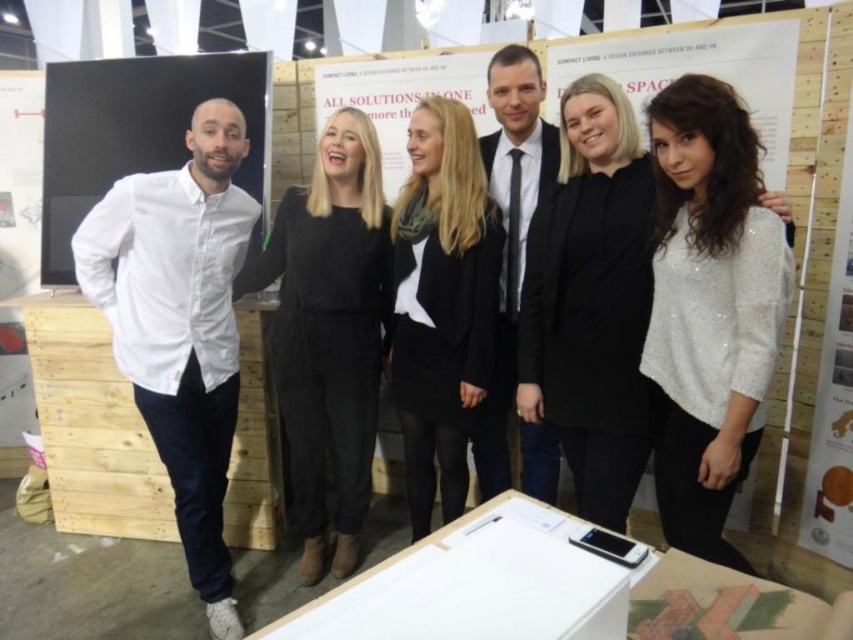
You are standing in front of the group at the exhibition booth. You need to locate the black matte blazer at center. Where exactly is it positioned in relation to the group?

The black matte blazer at center is positioned at the coordinates point (440,304).

You are a photographer at the event and want to ensure both the white sequined sweater at center and the black matte blazer at center are visible in the photo. Based on their positions, can you confirm if both items are visible without any obstruction?

The white sequined sweater at center is in front of the black matte blazer at center, so the black matte blazer at center might be partially obscured. To ensure both are visible, adjust the angle so that neither item is directly blocking the other.